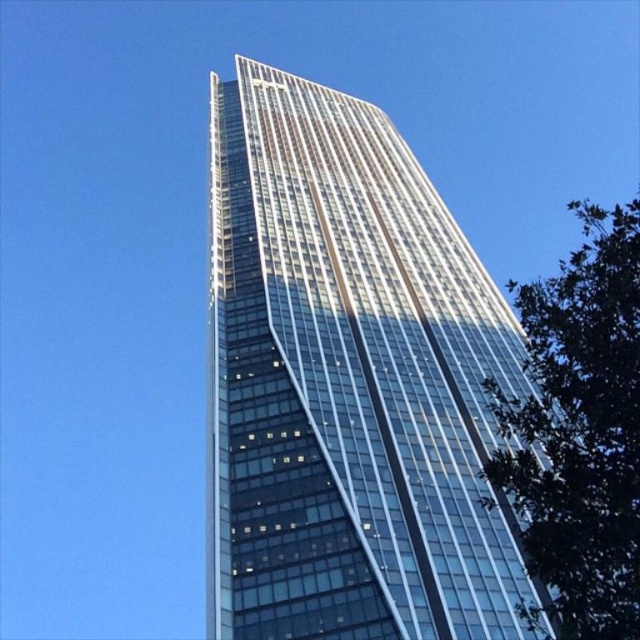
Between point (435, 193) and point (621, 378), which one is positioned behind?

The point (435, 193) is more distant.

Between point (256, 400) and point (573, 550), which one is positioned in front?

Positioned in front is point (573, 550).

Which is in front, point (504, 349) or point (604, 307)?

Point (604, 307) is in front.

What are the coordinates of `transparent glass tower at center` in the screenshot? It's located at (349, 384).